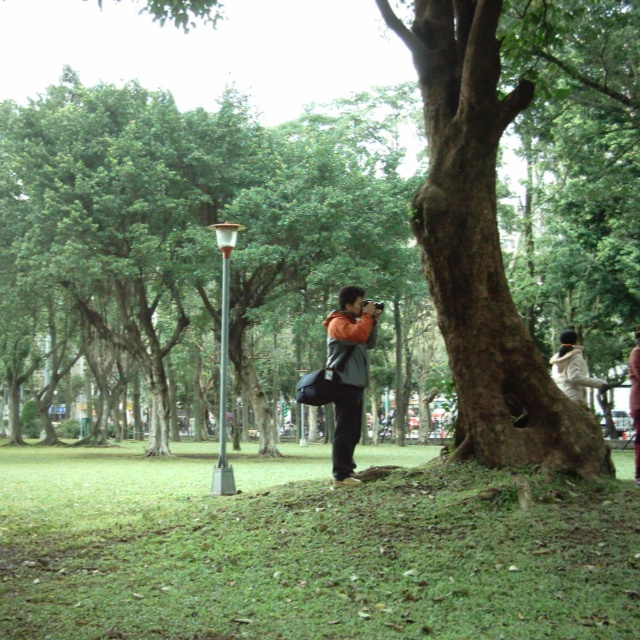
Between metallic pole at center and orange fabric jacket at center, which one appears on the right side from the viewer's perspective?

Positioned to the right is orange fabric jacket at center.

This screenshot has height=640, width=640. Find the location of `metallic pole at center`. metallic pole at center is located at coordinates (224, 358).

Locate an element on the screen. Image resolution: width=640 pixels, height=640 pixels. metallic pole at center is located at coordinates (224, 358).

Find the location of a particular element. metallic pole at center is located at coordinates (224, 358).

Is metallic pole at center positioned in front of white fleece jacket at lower right?

No, metallic pole at center is further to the viewer.

Between point (218, 468) and point (573, 392), which one is positioned in front?

Point (573, 392) is more forward.

Find the location of a particular element. This screenshot has width=640, height=640. metallic pole at center is located at coordinates click(x=224, y=358).

Is point (573, 381) closer to viewer compared to point (637, 397)?

No, (573, 381) is further to viewer.

Is white fleece jacket at lower right closer to camera compared to orange fabric jacket at center?

Yes, white fleece jacket at lower right is in front of orange fabric jacket at center.

Is point (593, 376) closer to camera compared to point (632, 349)?

No, it is not.

At what (x,y) coordinates should I click in order to perform the action: click on white fleece jacket at lower right. Please return your answer as a coordinate pair (x, y). The width and height of the screenshot is (640, 640). Looking at the image, I should click on (572, 369).